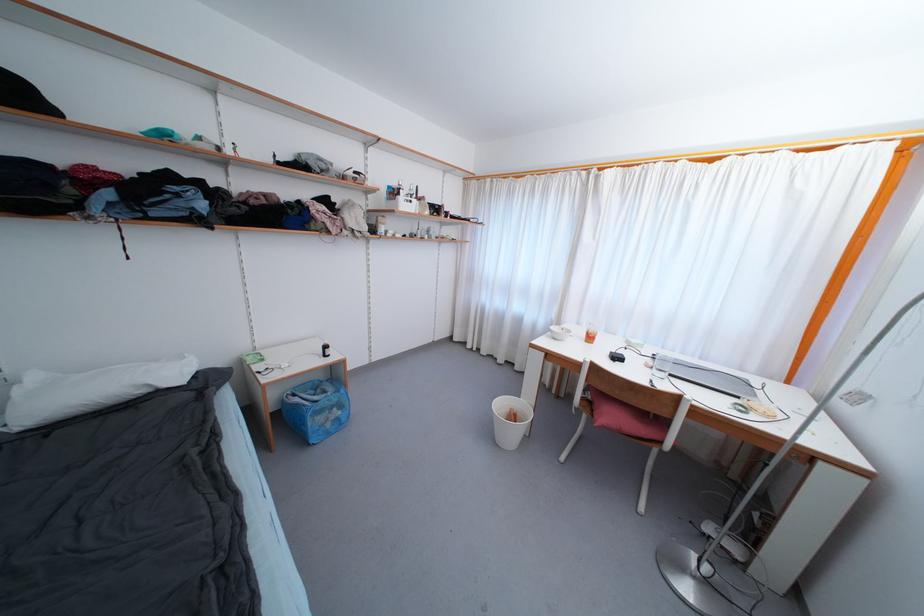
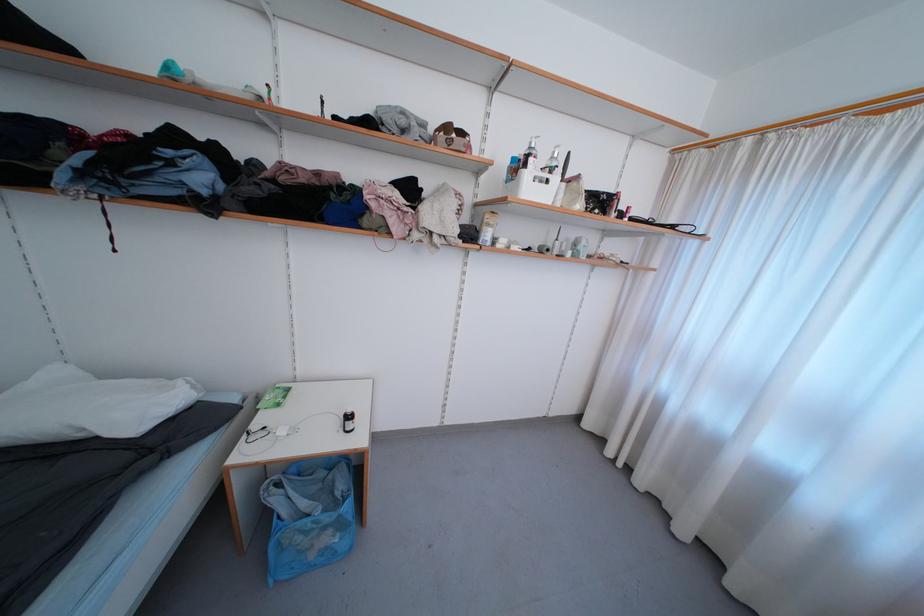
Locate, in the second image, the point that corresponds to [431,215] in the first image.

(584, 208)